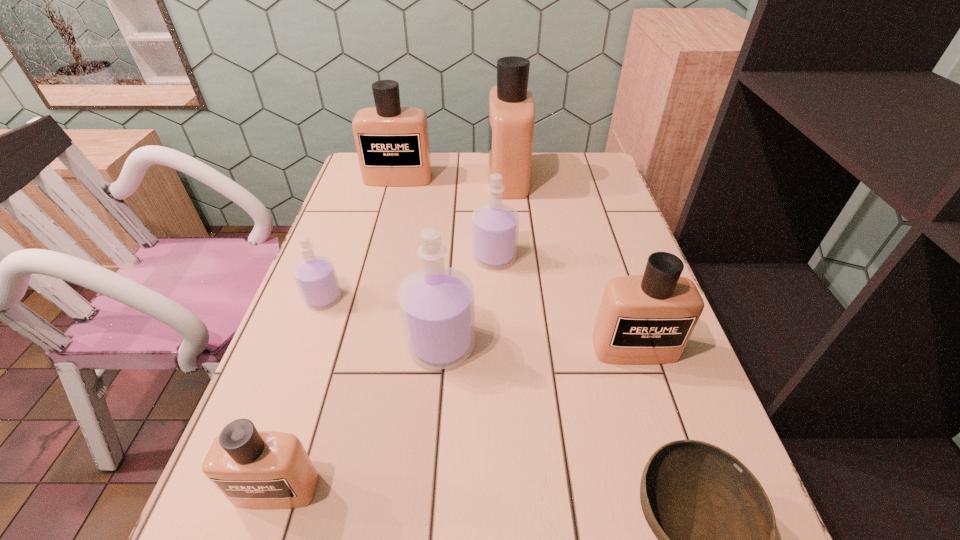
The image size is (960, 540). What are the coordinates of `free space between the biggest purple perfume and the nearest beige perfume` in the screenshot? It's located at (359, 417).

Find the location of `free spot between the second smallest beige perfume and the tallest object`. free spot between the second smallest beige perfume and the tallest object is located at coordinates (571, 263).

Locate which object is the sixth closest to the nearest purple perfume. Please provide its 2D coordinates. Your answer should be formatted as a tuple, i.e. [(x, y)], where the tuple contains the x and y coordinates of a point satisfying the conditions above.

[(511, 121)]

Identify the location of the seventh closest object to the second biggest beige perfume. The width and height of the screenshot is (960, 540). tap(716, 529).

Select which perfume appears as the third closest to the second smallest purple perfume. Please provide its 2D coordinates. Your answer should be formatted as a tuple, i.e. [(x, y)], where the tuple contains the x and y coordinates of a point satisfying the conditions above.

[(643, 319)]

Where is `the third closest perfume to the biggest beige perfume`? Image resolution: width=960 pixels, height=540 pixels. the third closest perfume to the biggest beige perfume is located at coordinates (436, 303).

The height and width of the screenshot is (540, 960). I want to click on the closest beige perfume relative to the rightmost perfume, so click(x=511, y=121).

Where is `beige perfume identified as the second closest to the biggest purple perfume`? beige perfume identified as the second closest to the biggest purple perfume is located at coordinates (643, 319).

At what (x,y) coordinates should I click in order to perform the action: click on the third closest purple perfume to the rightmost beige perfume. Please return your answer as a coordinate pair (x, y). Looking at the image, I should click on (315, 275).

This screenshot has width=960, height=540. Identify the location of purple perfume object that ranks as the second closest to the smallest purple perfume. (494, 226).